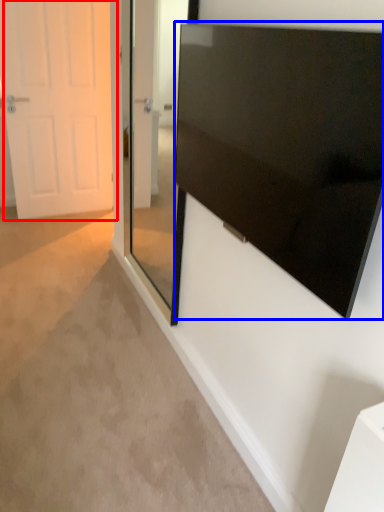
Question: Among these objects, which one is nearest to the camera, door (highlighted by a red box) or screen (highlighted by a blue box)?

Choices:
 (A) door
 (B) screen

Answer: (B)